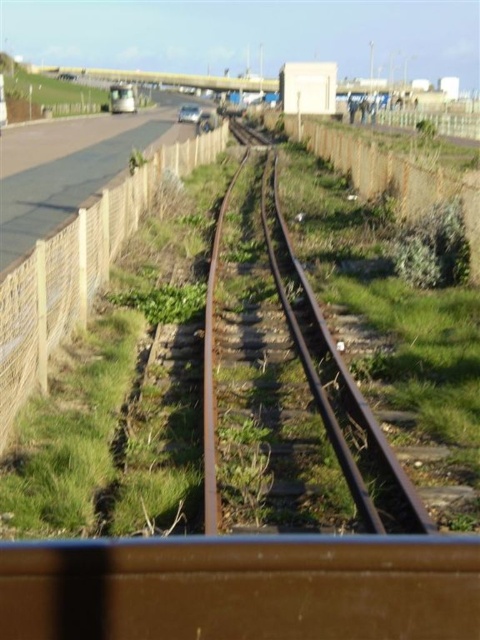
You are standing at the center of the image and want to reach the brown woven fence at left. Which direction should you move to get there?

To reach the brown woven fence at left, you should move to the left since it is located at point 0.422 on the x and 0.163 on the y coordinate, which is to the left of the center position.

You are standing at point (314, 385) and want to walk to point (134, 211). Given the scene description, is the path along the railway track between these two points passable for walking?

The path along the railway track between point (134, 211) and point (314, 385) is not passable because the railway track is in disrepair with missing or broken rails and vegetation growing between the tracks, making it unsafe for walking.

You are standing at the origin point of the image, which is the bottom left corner. You want to walk to the green grass at center. In which direction should you move first?

Since the green grass at center is located at point (x=251, y=364) in the image coordinate system, you should move towards the right and slightly upwards from the origin point to reach it.